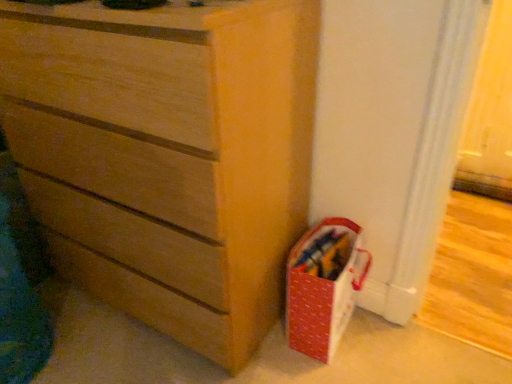
You are a GUI agent. You are given a task and a screenshot of the screen. Output one action in this format:
    pyautogui.click(x=<x>, y=<y>)
    Task: Click on the free area in between matte wood chest of drawers at center and red fabric basket at lower right
    
    Given the screenshot: What is the action you would take?
    pyautogui.click(x=279, y=366)